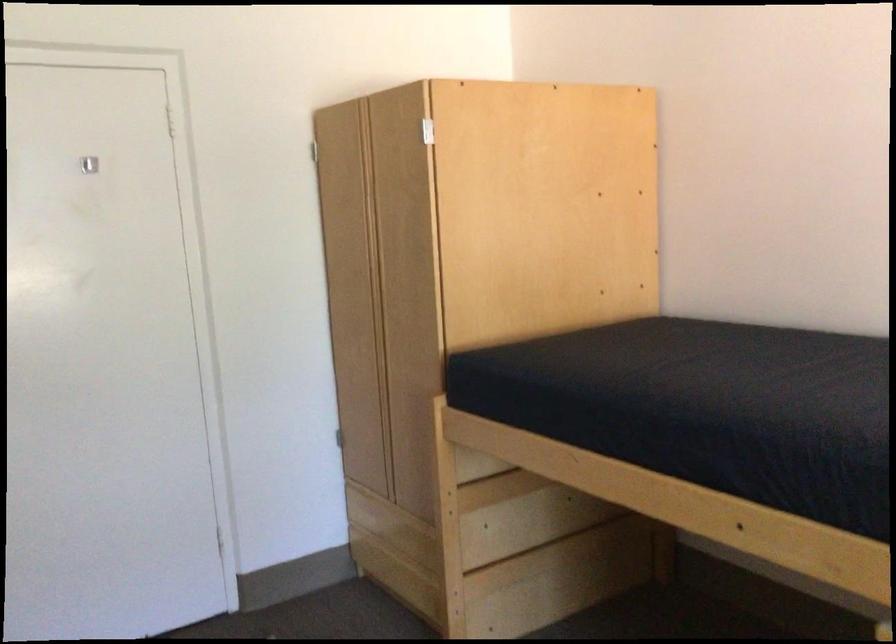
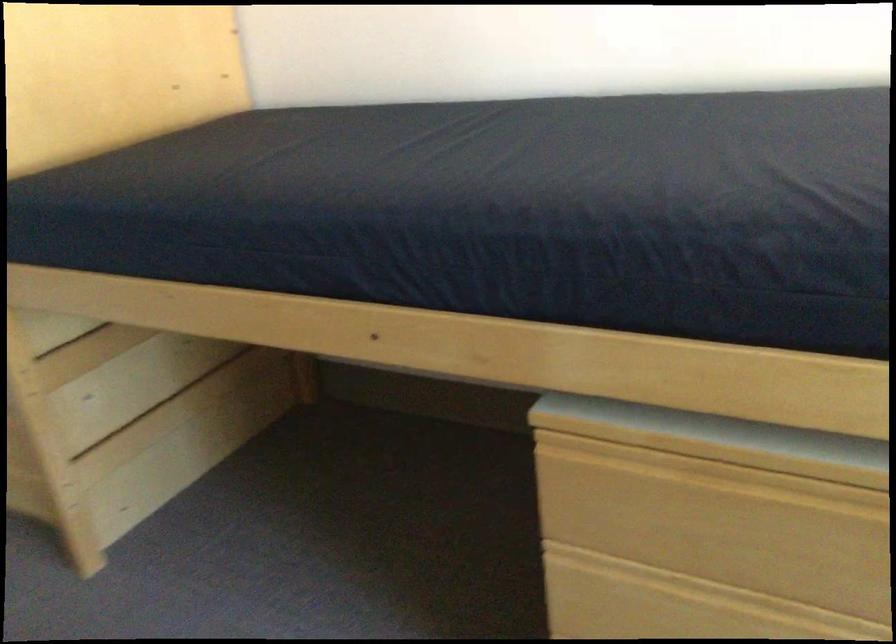
Which direction would the cameraman need to move to produce the second image?

The cameraman moved toward right, forward.